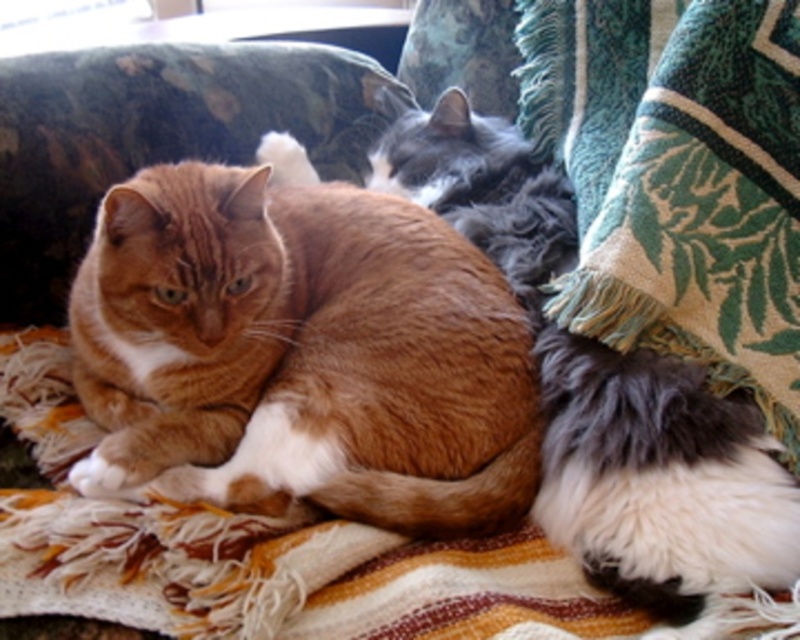
Question: Does orange tabby cat at center have a larger size compared to green woven blanket at lower right?

Choices:
 (A) no
 (B) yes

Answer: (B)

Question: Can you confirm if orange tabby cat at center is wider than green woven blanket at lower right?

Choices:
 (A) yes
 (B) no

Answer: (A)

Question: Which of the following is the farthest from the observer?

Choices:
 (A) (634, 32)
 (B) (128, 228)

Answer: (A)

Question: Which of the following is the closest to the observer?

Choices:
 (A) (754, 268)
 (B) (325, 252)

Answer: (A)

Question: Considering the relative positions of orange tabby cat at center and green woven blanket at lower right in the image provided, where is orange tabby cat at center located with respect to green woven blanket at lower right?

Choices:
 (A) below
 (B) above

Answer: (A)